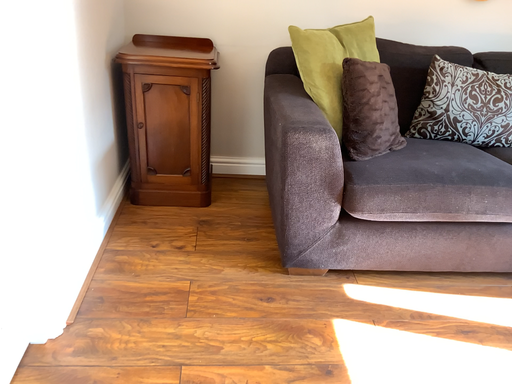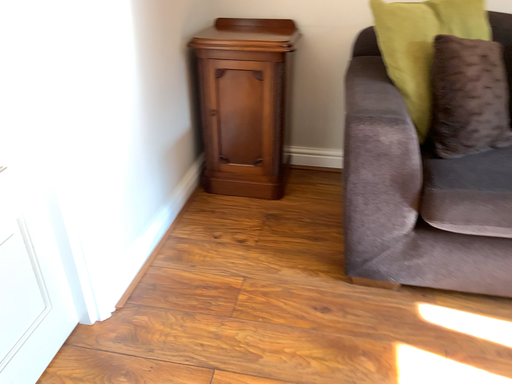
Question: How did the camera likely rotate when shooting the video?

Choices:
 (A) rotated left
 (B) rotated right

Answer: (A)